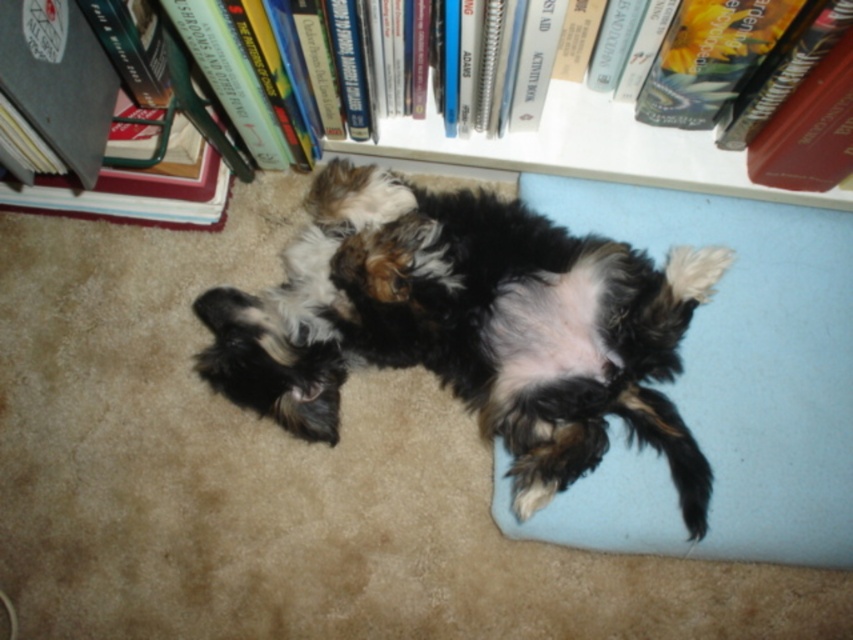
You are trying to decide whether to place a new tall plant next to the white plastic bookcase at upper center or the hardcover book at left. Based on their heights, which location would be better for the plant to not block the view of the bookcase?

The white plastic bookcase at upper center is shorter than the hardcover book at left, so placing the plant next to the hardcover book at left would be better since the taller book will block the view of the plant, allowing the shorter bookcase to remain visible.

You are a cat trying to reach the hardcover book at left from the white plastic bookcase at upper center. Can you jump from the bookcase to the book?

The white plastic bookcase at upper center is located below the hardcover book at left, so the book is above the bookcase. Since cats can jump upwards, you can jump from the bookcase to the hardcover book at left.